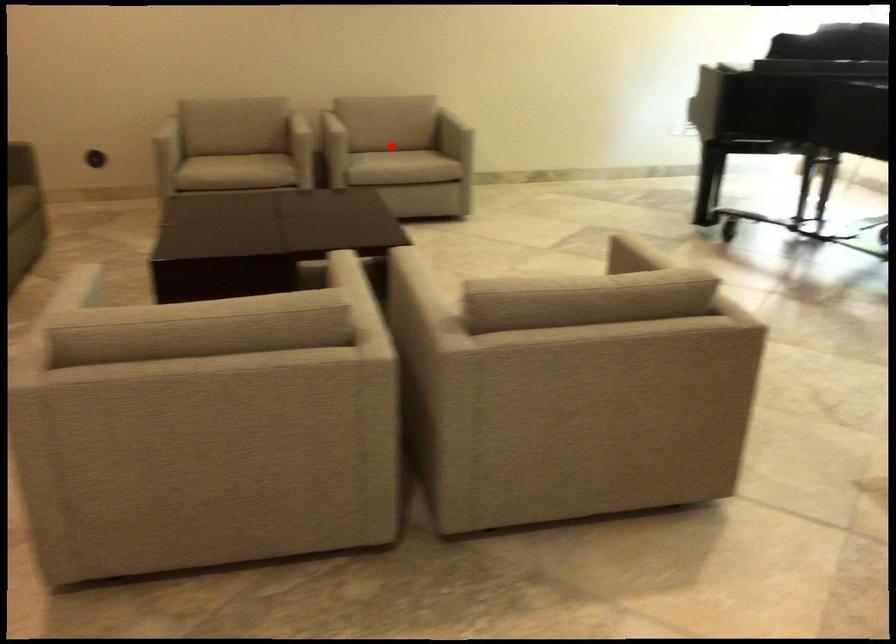
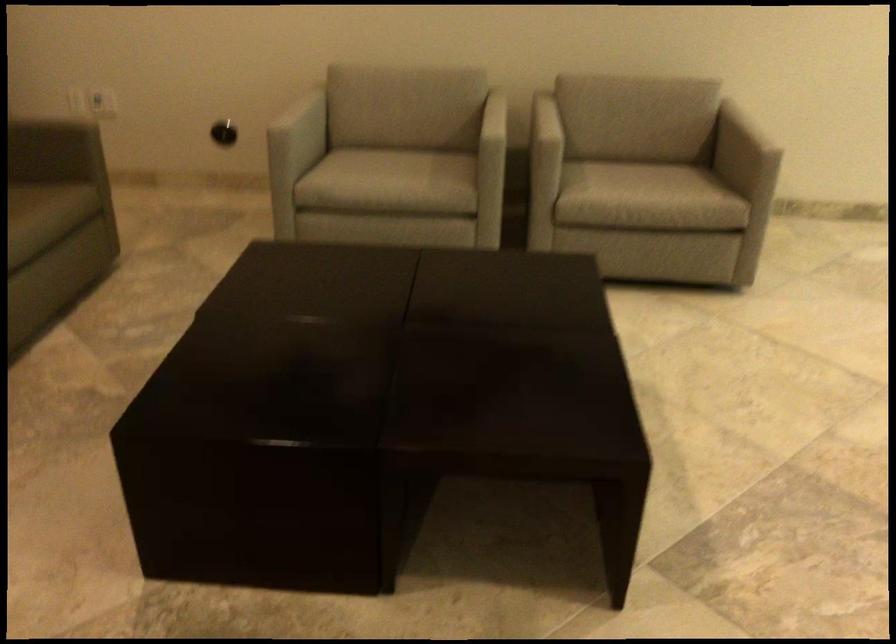
Question: I am providing you with two images of the same scene from different viewpoints. In image1, a red point is highlighted. Considering the same 3D point in image2, which of the following is correct?

Choices:
 (A) It is closer
 (B) It is farther

Answer: (A)